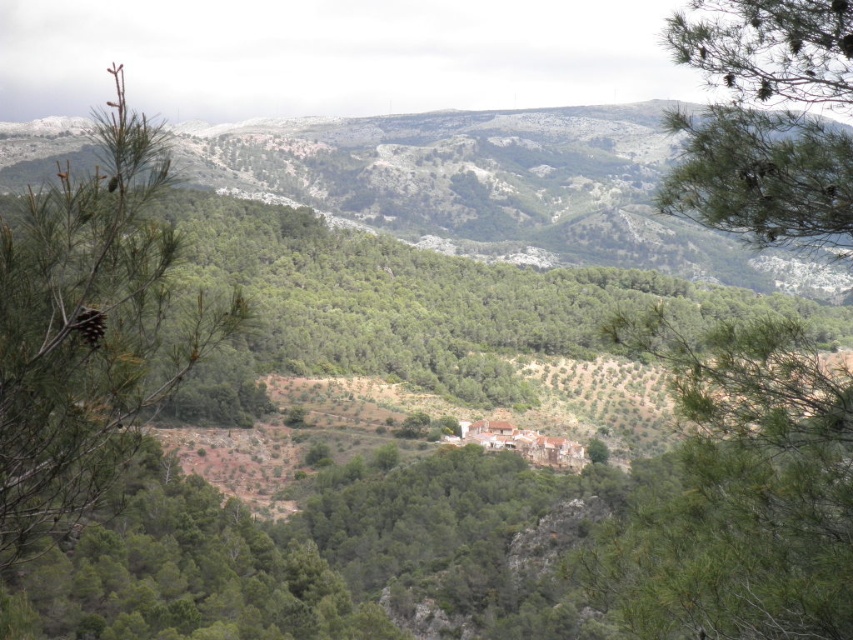
Question: Is green leafy tree at center closer to camera compared to green needle-like at upper right?

Choices:
 (A) yes
 (B) no

Answer: (A)

Question: In this image, where is green textured hillside at upper center located relative to green leafy tree at center?

Choices:
 (A) left
 (B) right

Answer: (A)

Question: Among these objects, which one is nearest to the camera?

Choices:
 (A) green textured hillside at upper center
 (B) green needle-like branch at left

Answer: (B)

Question: Estimate the real-world distances between objects in this image. Which object is closer to the green leafy tree at center?

Choices:
 (A) green needle-like branch at left
 (B) green textured hillside at upper center
 (C) green needle-like at upper right

Answer: (C)

Question: Can you confirm if green textured hillside at upper center is positioned above green leafy tree at center?

Choices:
 (A) no
 (B) yes

Answer: (B)

Question: Which point is closer to the camera?

Choices:
 (A) [33, 173]
 (B) [35, 337]
 (C) [804, 572]

Answer: (B)